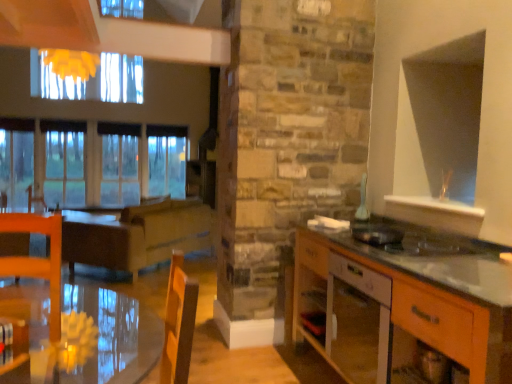
Question: Can you confirm if metallic silver toaster at right, acting as the second appliance starting from the top, is smaller than wooden cabinet at right?

Choices:
 (A) no
 (B) yes

Answer: (B)

Question: Is metallic silver toaster at right, marked as the first appliance in a front-to-back arrangement, not inside wooden cabinet at right?

Choices:
 (A) no
 (B) yes

Answer: (A)

Question: Can you confirm if metallic silver toaster at right, acting as the second appliance starting from the top, is positioned to the left of wooden cabinet at right?

Choices:
 (A) yes
 (B) no

Answer: (A)

Question: Is metallic silver toaster at right, acting as the 2th appliance starting from the back, thinner than wooden cabinet at right?

Choices:
 (A) no
 (B) yes

Answer: (B)

Question: Does metallic silver toaster at right, which ranks as the 1th appliance in bottom-to-top order, turn towards wooden cabinet at right?

Choices:
 (A) yes
 (B) no

Answer: (A)

Question: Is metallic silver toaster at right, acting as the second appliance starting from the top, wider than wooden cabinet at right?

Choices:
 (A) no
 (B) yes

Answer: (A)

Question: Can you confirm if wooden cabinet at right is smaller than white glossy vase at upper right, the first appliance in the back-to-front sequence?

Choices:
 (A) no
 (B) yes

Answer: (A)

Question: Considering the relative sizes of wooden cabinet at right and white glossy vase at upper right, the 2th appliance from the bottom, in the image provided, is wooden cabinet at right bigger than white glossy vase at upper right, the 2th appliance from the bottom,?

Choices:
 (A) yes
 (B) no

Answer: (A)

Question: Would you say white glossy vase at upper right, the 2th appliance from the bottom, is part of wooden cabinet at right's contents?

Choices:
 (A) yes
 (B) no

Answer: (B)

Question: Is wooden cabinet at right far from white glossy vase at upper right, the first appliance in the back-to-front sequence?

Choices:
 (A) no
 (B) yes

Answer: (A)

Question: Can you confirm if wooden cabinet at right is thinner than white glossy vase at upper right, arranged as the second appliance when viewed from the front?

Choices:
 (A) yes
 (B) no

Answer: (B)

Question: Is wooden cabinet at right taller than white glossy vase at upper right, which is the 1th appliance from top to bottom?

Choices:
 (A) yes
 (B) no

Answer: (A)

Question: Considering the relative sizes of white glossy vase at upper right, the first appliance in the back-to-front sequence, and wooden cabinet at right in the image provided, is white glossy vase at upper right, the first appliance in the back-to-front sequence, taller than wooden cabinet at right?

Choices:
 (A) yes
 (B) no

Answer: (B)